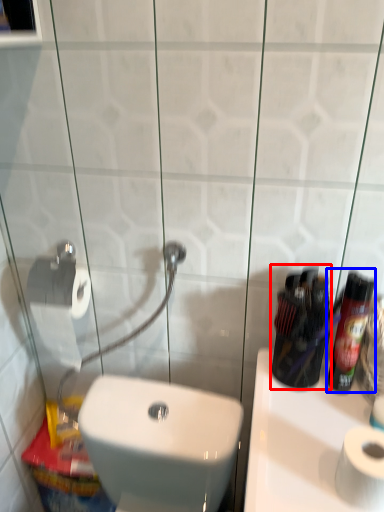
Question: Among these objects, which one is nearest to the camera, mouthwash (highlighted by a red box) or cleaning product (highlighted by a blue box)?

Choices:
 (A) mouthwash
 (B) cleaning product

Answer: (B)